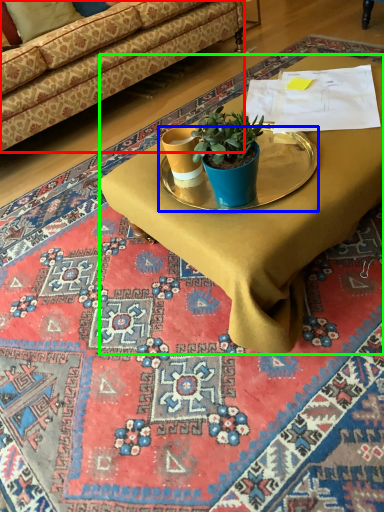
Question: Which is farther away from studio couch (highlighted by a red box)? round table (highlighted by a blue box) or desk (highlighted by a green box)?

Choices:
 (A) round table
 (B) desk

Answer: (A)